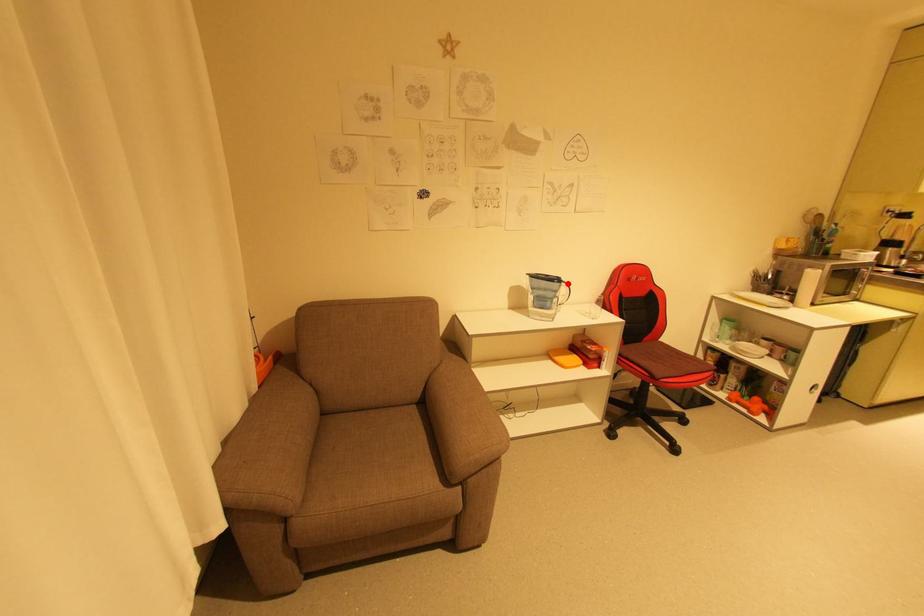
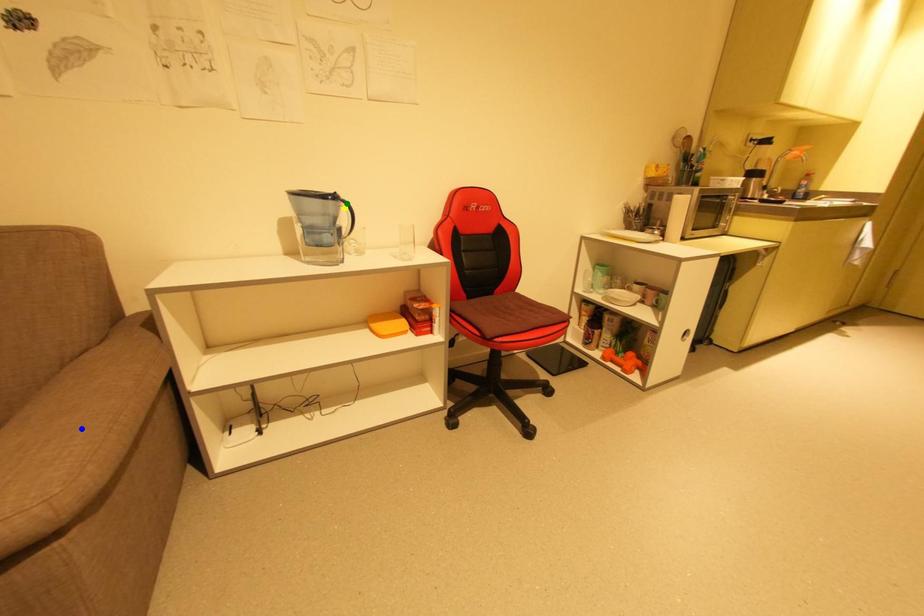
Question: I am providing you with two images of the same scene from different viewpoints. A red point is marked on the first image. You are given multiple points on the second image. Which point in image 2 represents the same 3d spot as the red point in image 1?

Choices:
 (A) yellow point
 (B) green point
 (C) blue point

Answer: (B)